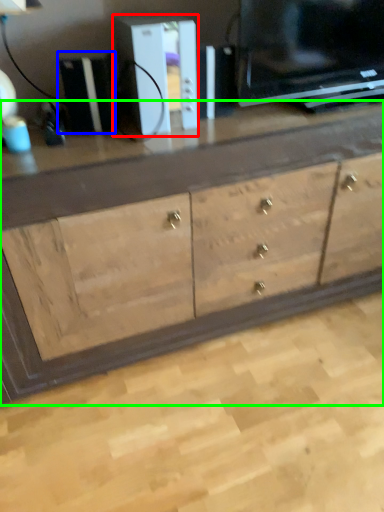
Question: Which object is the farthest from appliance (highlighted by a red box)? Choose among these: appliance (highlighted by a blue box) or chest of drawers (highlighted by a green box).

Choices:
 (A) appliance
 (B) chest of drawers

Answer: (B)